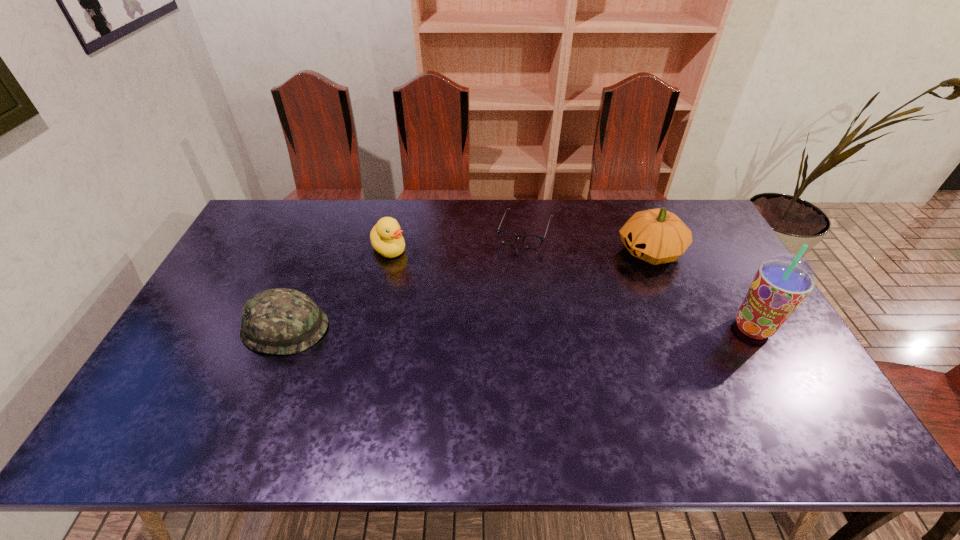
Locate an element on the screen. The image size is (960, 540). vacant area located through the lenses of the spectacles is located at coordinates (516, 259).

Locate an element on the screen. vacant space located 0.320m through the lenses of the spectacles is located at coordinates (494, 320).

Identify the location of free space located through the lenses of the spectacles. (506, 286).

Locate an element on the screen. vacant area situated at the beak of the duck is located at coordinates (423, 284).

Identify the location of vacant space located at the beak of the duck. (442, 302).

Where is `free space located 0.320m at the beak of the duck`? free space located 0.320m at the beak of the duck is located at coordinates (455, 317).

The height and width of the screenshot is (540, 960). Find the location of `vacant space located 0.070m on the side of the gourd with the carved face`. vacant space located 0.070m on the side of the gourd with the carved face is located at coordinates (610, 271).

The height and width of the screenshot is (540, 960). Identify the location of vacant area situated 0.210m on the side of the gourd with the carved face. (576, 288).

Where is `vacant space located on the side of the gourd with the carved face`? The height and width of the screenshot is (540, 960). vacant space located on the side of the gourd with the carved face is located at coordinates (586, 283).

In order to click on spectacles located in the far edge section of the desktop in this screenshot , I will do pos(508,237).